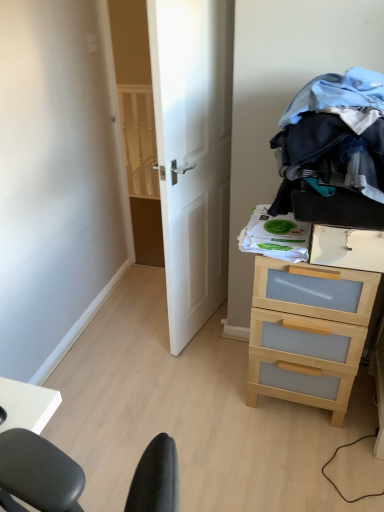
What do you see at coordinates (333, 138) in the screenshot? I see `denim fabric clothes at upper right` at bounding box center [333, 138].

What is the approximate height of light wood/ribbed drawer at right?

It is 80.34 centimeters.

Find the location of a particular element. Image resolution: width=384 pixels, height=512 pixels. denim fabric clothes at upper right is located at coordinates (333, 138).

Consider the image. Is white wooden door at center surrounded by light wood/ribbed drawer at right?

That's incorrect, white wooden door at center is not inside light wood/ribbed drawer at right.

How many degrees apart are the facing directions of light wood/ribbed drawer at right and white wooden door at center?

light wood/ribbed drawer at right and white wooden door at center are facing 104 degrees away from each other.

Based on the photo, from a real-world perspective, is light wood/ribbed drawer at right below white wooden door at center?

Yes, from a real-world perspective, light wood/ribbed drawer at right is below white wooden door at center.

Considering the positions of points (343, 298) and (202, 287), is point (343, 298) closer to camera compared to point (202, 287)?

Yes.

Is white wooden door at center far away from light wood/ribbed drawer at right?

No, there isn't a large distance between white wooden door at center and light wood/ribbed drawer at right.

Where is `door that is above the light wood/ribbed drawer at right (from a real-world perspective)`? Image resolution: width=384 pixels, height=512 pixels. door that is above the light wood/ribbed drawer at right (from a real-world perspective) is located at coordinates (193, 153).

What's the angular difference between white wooden door at center and light wood/ribbed drawer at right's facing directions?

104 degrees.

Is white wooden door at center at the left side of light wood/ribbed drawer at right?

Correct, you'll find white wooden door at center to the left of light wood/ribbed drawer at right.

What's the angular difference between white wooden door at center and denim fabric clothes at upper right's facing directions?

white wooden door at center and denim fabric clothes at upper right are facing 105 degrees away from each other.

Based on their sizes in the image, would you say white wooden door at center is bigger or smaller than denim fabric clothes at upper right?

In the image, white wooden door at center appears to be larger than denim fabric clothes at upper right.

From a real-world perspective, which object stands above the other?

denim fabric clothes at upper right is physically above.

Which object is positioned more to the left, white wooden door at center or denim fabric clothes at upper right?

white wooden door at center.

Considering the sizes of objects denim fabric clothes at upper right and white wooden door at center in the image provided, who is shorter, denim fabric clothes at upper right or white wooden door at center?

Standing shorter between the two is denim fabric clothes at upper right.

Locate an element on the screen. The width and height of the screenshot is (384, 512). door located below the denim fabric clothes at upper right (from the image's perspective) is located at coordinates (193, 153).

Between denim fabric clothes at upper right and white wooden door at center, which one has smaller size?

Smaller between the two is denim fabric clothes at upper right.

Does point (358, 147) come farther from viewer compared to point (175, 116)?

No, (358, 147) is in front of (175, 116).

Between light wood/ribbed drawer at right and denim fabric clothes at upper right, which one appears on the left side from the viewer's perspective?

Positioned to the left is denim fabric clothes at upper right.

Considering the sizes of objects light wood/ribbed drawer at right and denim fabric clothes at upper right in the image provided, who is thinner, light wood/ribbed drawer at right or denim fabric clothes at upper right?

light wood/ribbed drawer at right is thinner.

Considering the sizes of light wood/ribbed drawer at right and denim fabric clothes at upper right in the image, is light wood/ribbed drawer at right bigger or smaller than denim fabric clothes at upper right?

Clearly, light wood/ribbed drawer at right is larger in size than denim fabric clothes at upper right.

From the image's perspective, is denim fabric clothes at upper right located above light wood/ribbed drawer at right?

Yes, from the image's perspective, denim fabric clothes at upper right is on top of light wood/ribbed drawer at right.

Is denim fabric clothes at upper right turned away from light wood/ribbed drawer at right?

That's not correct — denim fabric clothes at upper right is not looking away from light wood/ribbed drawer at right.

What's the angular difference between denim fabric clothes at upper right and light wood/ribbed drawer at right's facing directions?

denim fabric clothes at upper right and light wood/ribbed drawer at right are facing 0.794 degrees away from each other.

Image resolution: width=384 pixels, height=512 pixels. I want to click on clothing positioned vertically above the light wood/ribbed drawer at right (from a real-world perspective), so click(x=333, y=138).

Locate an element on the screen. the chest of drawers lying behind the white wooden door at center is located at coordinates (308, 333).

Locate an element on the screen. Image resolution: width=384 pixels, height=512 pixels. chest of drawers to the right of white wooden door at center is located at coordinates (308, 333).

When comparing their distances from light wood/ribbed drawer at right, does denim fabric clothes at upper right or white wooden door at center seem closer?

denim fabric clothes at upper right.

Considering their positions, is light wood/ribbed drawer at right positioned closer to white wooden door at center than denim fabric clothes at upper right?

denim fabric clothes at upper right.

Based on the photo, based on their spatial positions, is white wooden door at center or light wood/ribbed drawer at right closer to denim fabric clothes at upper right?

light wood/ribbed drawer at right lies closer to denim fabric clothes at upper right than the other object.

Considering their positions, is denim fabric clothes at upper right positioned closer to white wooden door at center than light wood/ribbed drawer at right?

The object closer to white wooden door at center is denim fabric clothes at upper right.

Estimate the real-world distances between objects in this image. Which object is further from denim fabric clothes at upper right, light wood/ribbed drawer at right or white wooden door at center?

The object further to denim fabric clothes at upper right is white wooden door at center.

When comparing their distances from light wood/ribbed drawer at right, does white wooden door at center or denim fabric clothes at upper right seem further?

white wooden door at center.

This screenshot has height=512, width=384. Find the location of `door between denim fabric clothes at upper right and light wood/ribbed drawer at right in the vertical direction`. door between denim fabric clothes at upper right and light wood/ribbed drawer at right in the vertical direction is located at coordinates (193, 153).